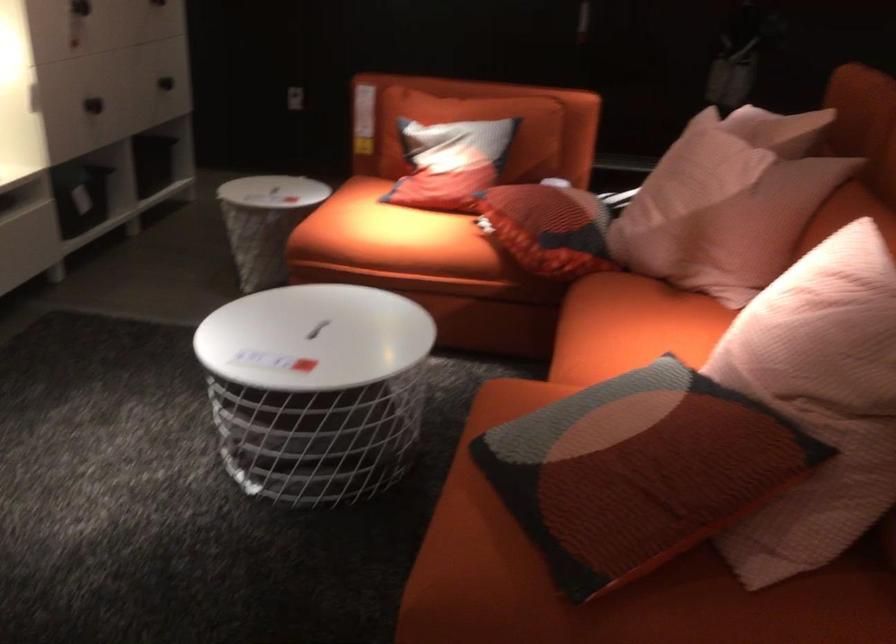
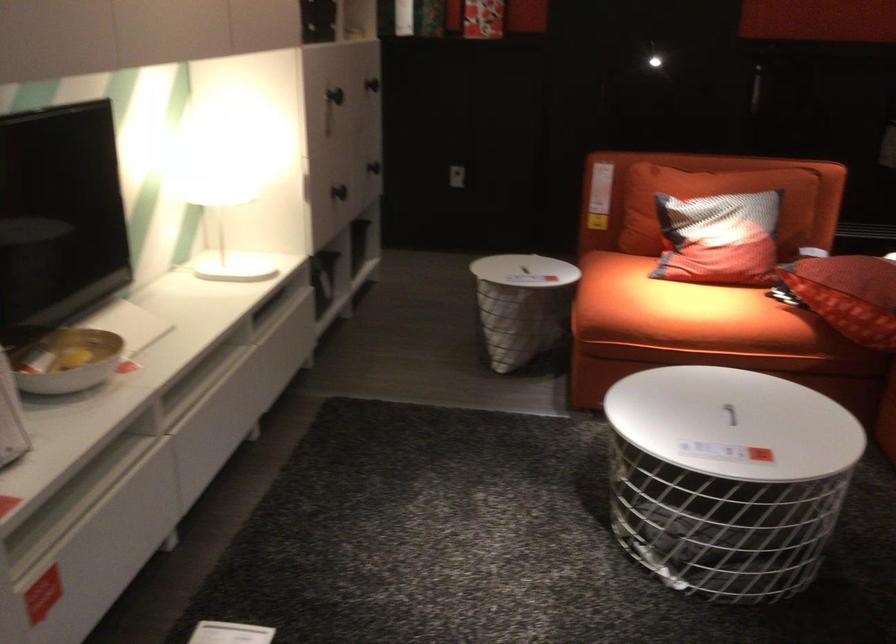
In the second image, find the point that corresponds to pixel 271 191 in the first image.

(522, 270)